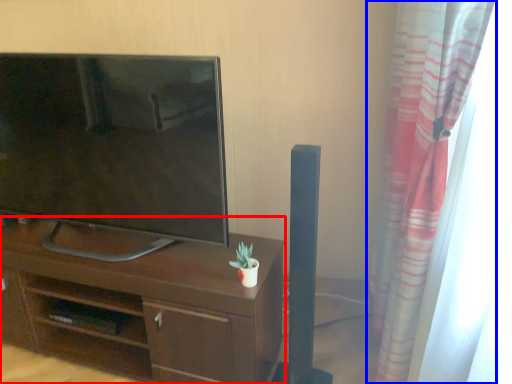
Question: Which of the following is the farthest to the observer, desk (highlighted by a red box) or curtain (highlighted by a blue box)?

Choices:
 (A) desk
 (B) curtain

Answer: (A)